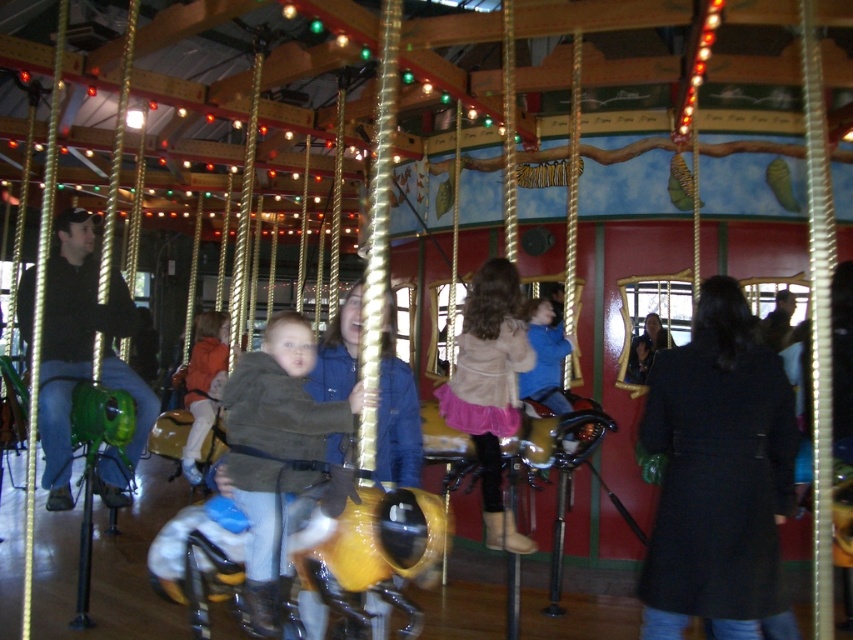
Is pink satin skirt at center taller than orange fleece jacket at center?

Yes, pink satin skirt at center is taller than orange fleece jacket at center.

Measure the distance between pink satin skirt at center and camera.

pink satin skirt at center is 15.31 feet away from camera.

Between point (442, 401) and point (193, 371), which one is positioned in front?

Point (442, 401) is in front.

Locate an element on the screen. This screenshot has width=853, height=640. pink satin skirt at center is located at coordinates (490, 388).

Does point (305, 442) come closer to viewer compared to point (480, 353)?

Yes, point (305, 442) is in front of point (480, 353).

Consider the image. Is brown leather jacket at center in front of pink satin skirt at center?

Yes, it is.

Who is more distant from viewer, (299, 397) or (494, 353)?

The point (494, 353) is behind.

Identify the location of brown leather jacket at center. (276, 452).

Can you confirm if brown leather jacket at center is smaller than orange fleece jacket at center?

Yes, brown leather jacket at center is smaller than orange fleece jacket at center.

Who is lower down, brown leather jacket at center or orange fleece jacket at center?

brown leather jacket at center is below.

Between point (256, 595) and point (194, 444), which one is positioned behind?

The point (194, 444) is behind.

Locate an element on the screen. brown leather jacket at center is located at coordinates (276, 452).